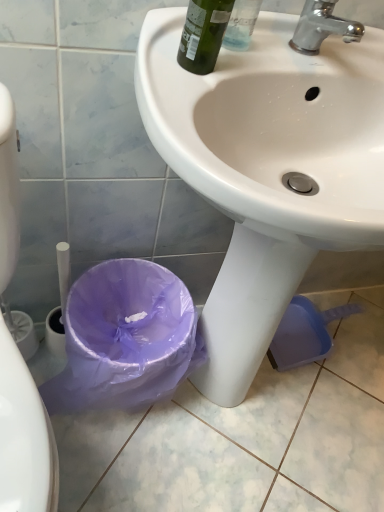
In order to click on free space in front of chrome metallic faucet at upper right in this screenshot , I will do `click(270, 65)`.